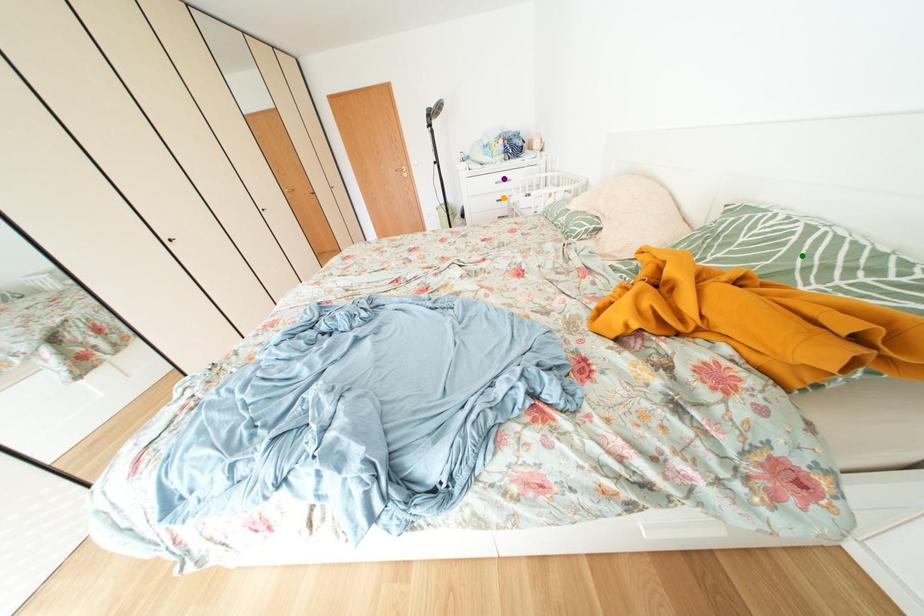
Order these from nearest to farthest:
A) orange point
B) green point
C) purple point

green point, orange point, purple point